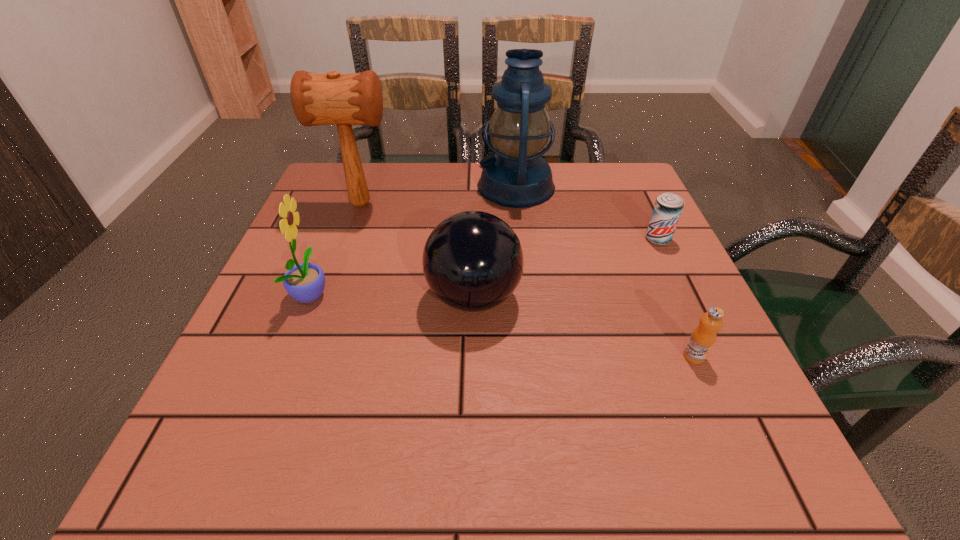
Image resolution: width=960 pixels, height=540 pixels. What are the coordinates of `lantern` in the screenshot? It's located at (519, 128).

The height and width of the screenshot is (540, 960). What are the coordinates of `mallet` in the screenshot? It's located at (317, 99).

This screenshot has width=960, height=540. Identify the location of sunflower. (305, 282).

Identify the location of the fourth tallest object. (472, 261).

Identify the location of the nearest object. (703, 337).

The width and height of the screenshot is (960, 540). Find the location of `beer can`. beer can is located at coordinates (668, 207).

You are a GUI agent. You are given a task and a screenshot of the screen. Output one action in this format:
    pyautogui.click(x=<x>, y=<y>)
    Task: Click on the vacant space situated on the face of the lantern
    This screenshot has height=540, width=960.
    Given the screenshot: What is the action you would take?
    pyautogui.click(x=401, y=186)

Locate an element on the screen. The image size is (960, 540). vacant space situated on the face of the lantern is located at coordinates 369,186.

The image size is (960, 540). I want to click on free region located on the face of the lantern, so click(x=373, y=186).

The height and width of the screenshot is (540, 960). Find the location of `free space located 0.100m on the strike surface of the mallet`. free space located 0.100m on the strike surface of the mallet is located at coordinates (440, 204).